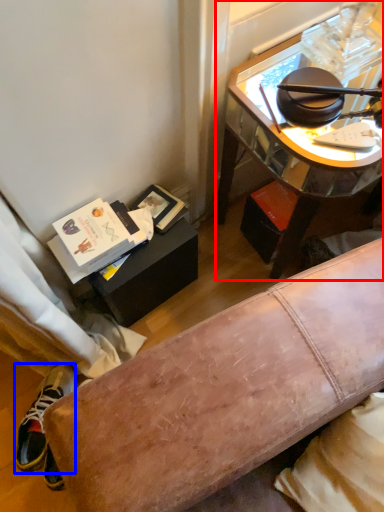
Question: Which point is further to the camera, desk (highlighted by a red box) or shoe (highlighted by a blue box)?

Choices:
 (A) desk
 (B) shoe

Answer: (B)